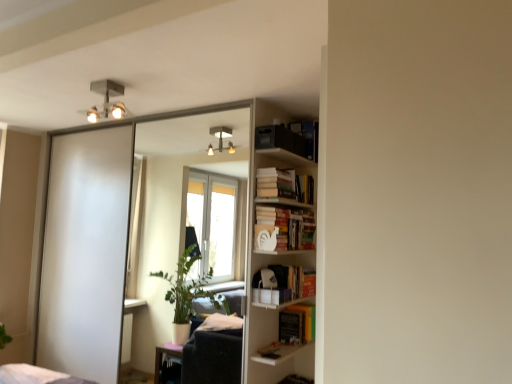
Question: Is white matte bookshelf at center-right, placed as the second book when sorted from bottom to top, aimed at yellow matte book at center, which ranks as the 1th book in bottom-to-top order?

Choices:
 (A) yes
 (B) no

Answer: (B)

Question: From the image's perspective, is white matte bookshelf at center-right, placed as the second book when sorted from bottom to top, beneath yellow matte book at center, which ranks as the 1th book in bottom-to-top order?

Choices:
 (A) yes
 (B) no

Answer: (B)

Question: Is white matte bookshelf at center-right, placed as the second book when sorted from bottom to top, to the left of yellow matte book at center, which is the 4th book from top to bottom, from the viewer's perspective?

Choices:
 (A) no
 (B) yes

Answer: (B)

Question: Considering the relative positions of white matte bookshelf at center-right, acting as the third book starting from the top, and yellow matte book at center, which ranks as the 1th book in bottom-to-top order, in the image provided, is white matte bookshelf at center-right, acting as the third book starting from the top, to the right of yellow matte book at center, which ranks as the 1th book in bottom-to-top order, from the viewer's perspective?

Choices:
 (A) yes
 (B) no

Answer: (B)

Question: Can you see white matte bookshelf at center-right, acting as the third book starting from the top, touching yellow matte book at center, which ranks as the 1th book in bottom-to-top order?

Choices:
 (A) no
 (B) yes

Answer: (A)

Question: From a real-world perspective, is white matte bookshelf at center-right, placed as the second book when sorted from bottom to top, under yellow matte book at center, which ranks as the 1th book in bottom-to-top order?

Choices:
 (A) yes
 (B) no

Answer: (B)

Question: Is metallic square light fixture at upper center turned away from white matte bookshelf at center-right, acting as the third book starting from the top?

Choices:
 (A) yes
 (B) no

Answer: (B)

Question: Can you confirm if metallic square light fixture at upper center is shorter than white matte bookshelf at center-right, acting as the third book starting from the top?

Choices:
 (A) no
 (B) yes

Answer: (B)

Question: Is metallic square light fixture at upper center placed right next to white matte bookshelf at center-right, placed as the second book when sorted from bottom to top?

Choices:
 (A) yes
 (B) no

Answer: (B)

Question: Does metallic square light fixture at upper center come behind white matte bookshelf at center-right, placed as the second book when sorted from bottom to top?

Choices:
 (A) no
 (B) yes

Answer: (A)

Question: From the image's perspective, would you say metallic square light fixture at upper center is shown under white matte bookshelf at center-right, acting as the third book starting from the top?

Choices:
 (A) no
 (B) yes

Answer: (A)

Question: Would you say white matte bookshelf at center-right, acting as the third book starting from the top, is part of metallic square light fixture at upper center's contents?

Choices:
 (A) no
 (B) yes

Answer: (A)

Question: Would you consider white matte bookshelf at center-right, placed as the second book when sorted from bottom to top, to be distant from metallic square light fixture at upper center?

Choices:
 (A) yes
 (B) no

Answer: (A)